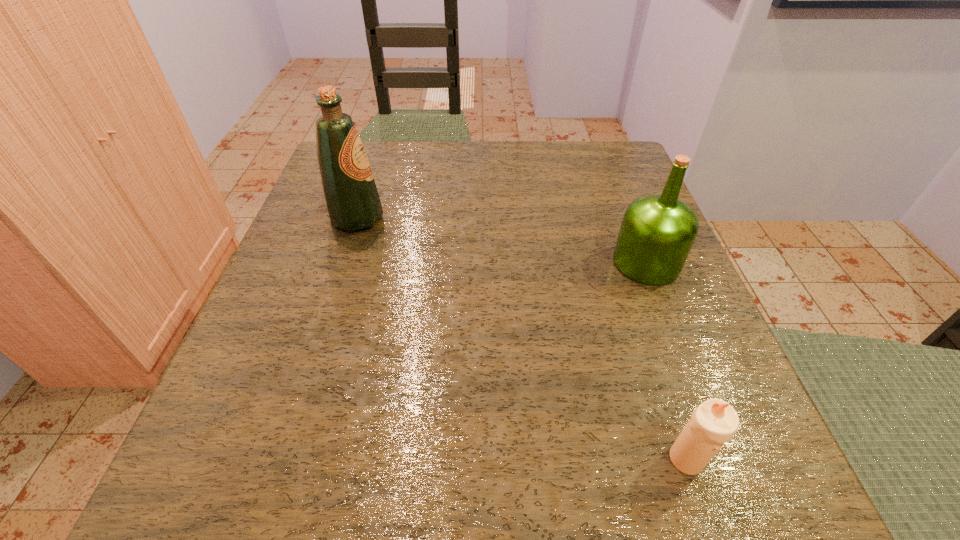
Where is `the taller olive oil`? the taller olive oil is located at coordinates (352, 200).

Where is `the farther olive oil`? This screenshot has height=540, width=960. the farther olive oil is located at coordinates [352, 200].

This screenshot has height=540, width=960. I want to click on the second farthest object, so click(x=657, y=233).

This screenshot has width=960, height=540. What are the coordinates of `the second tallest object` in the screenshot? It's located at (657, 233).

Locate an element on the screen. The image size is (960, 540). candle is located at coordinates (713, 423).

Image resolution: width=960 pixels, height=540 pixels. I want to click on the shortest object, so pos(713,423).

The height and width of the screenshot is (540, 960). What are the coordinates of `vacant space situated on the front-facing side of the farthest object` in the screenshot? It's located at (543, 219).

This screenshot has height=540, width=960. In order to click on vacant area situated 0.150m on the front of the nearer olive oil in this screenshot , I will do `click(684, 360)`.

Where is `vacant space located 0.060m on the back of the nearest object`? The height and width of the screenshot is (540, 960). vacant space located 0.060m on the back of the nearest object is located at coordinates (666, 399).

Locate an element on the screen. object that is positioned at the near edge is located at coordinates (713, 423).